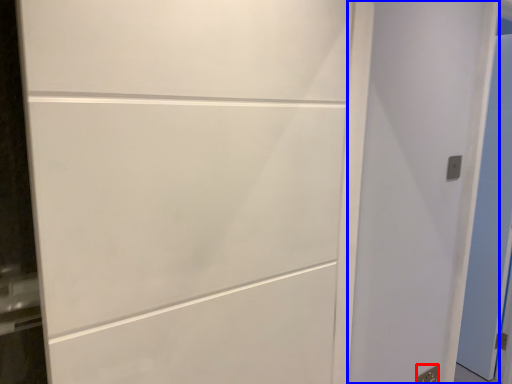
Question: Which of the following is the closest to the observer, electric outlet (highlighted by a red box) or door (highlighted by a blue box)?

Choices:
 (A) electric outlet
 (B) door

Answer: (B)